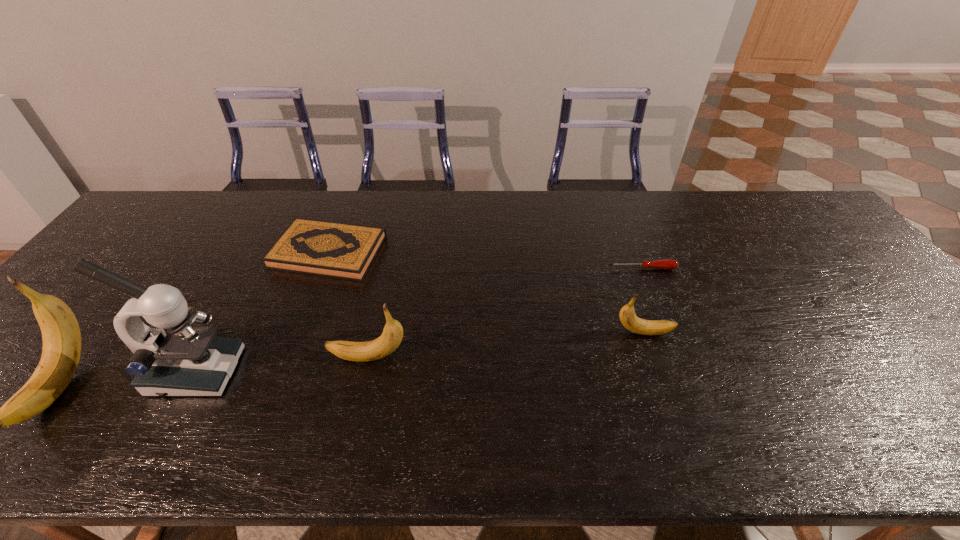
Locate an element on the screen. This screenshot has height=540, width=960. free spot located 0.320m at the start of the peel on the third tallest object is located at coordinates (193, 358).

Where is `free location located 0.160m at the start of the peel on the third tallest object`? The image size is (960, 540). free location located 0.160m at the start of the peel on the third tallest object is located at coordinates (261, 358).

Find the location of `vacant area situated at the start of the peel on the third shortest object`. vacant area situated at the start of the peel on the third shortest object is located at coordinates (757, 333).

Identify the location of free space located on the right of the hardback book. (410, 252).

Where is `free region located 0.320m on the right of the screwdriver`? The width and height of the screenshot is (960, 540). free region located 0.320m on the right of the screwdriver is located at coordinates (788, 268).

Find the location of a particular element. The image size is (960, 540). vacant space located 0.210m on the right of the tallest object is located at coordinates (326, 372).

Where is `object that is at the far edge`? This screenshot has width=960, height=540. object that is at the far edge is located at coordinates (338, 250).

Locate an element on the screen. banana situated at the near edge is located at coordinates (61, 335).

The image size is (960, 540). In order to click on microscope that is at the near edge in this screenshot , I will do `click(172, 358)`.

Find the location of a particular element. object that is at the left edge is located at coordinates (61, 335).